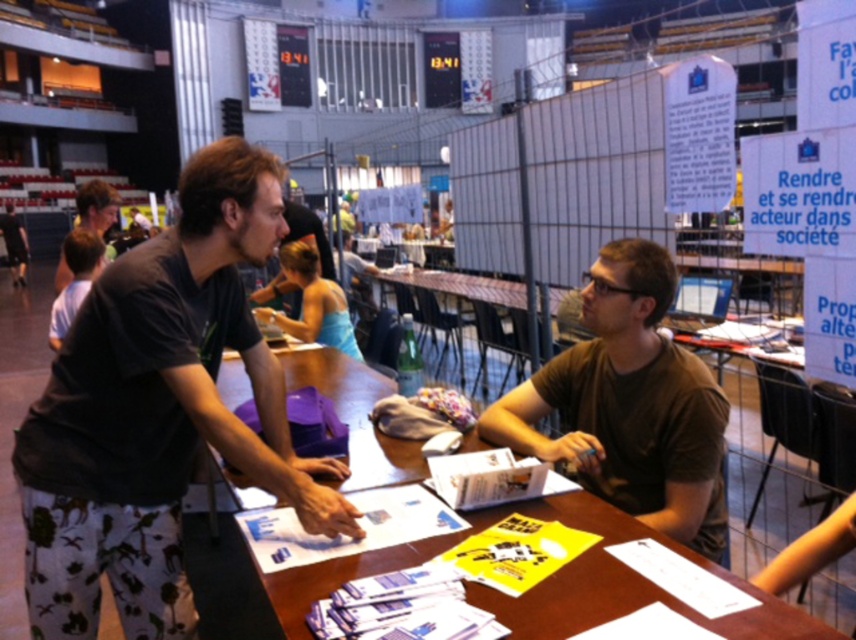
Question: Which point is farther to the camera?

Choices:
 (A) (86, 225)
 (B) (123, 483)

Answer: (A)

Question: Observing the image, what is the correct spatial positioning of dark gray t-shirt at left in reference to brown matte shirt at center?

Choices:
 (A) left
 (B) right

Answer: (A)

Question: Can you confirm if wooden table at center is positioned below dark brown shirt at upper left?

Choices:
 (A) yes
 (B) no

Answer: (A)

Question: Among these points, which one is farthest from the camera?

Choices:
 (A) pos(776,614)
 (B) pos(669,387)

Answer: (B)

Question: Does dark gray t-shirt at left appear under dark brown shirt at upper left?

Choices:
 (A) no
 (B) yes

Answer: (B)

Question: Which of the following is the farthest from the observer?

Choices:
 (A) dark gray t-shirt at left
 (B) dark brown shirt at upper left

Answer: (B)